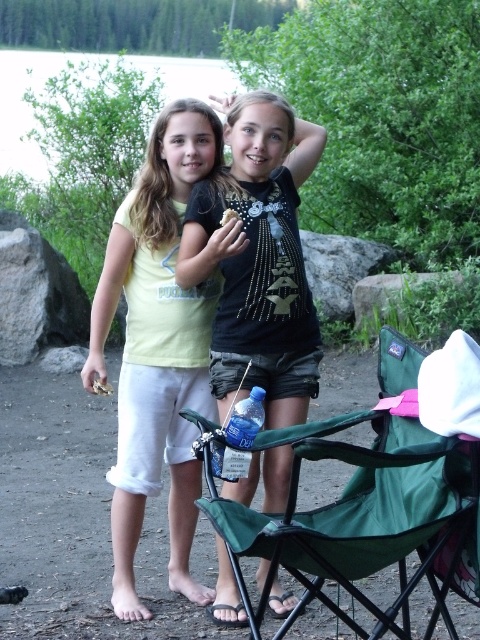
Between green fabric chair at lower center and matte yellow t-shirt at center, which one has less height?

With less height is green fabric chair at lower center.

Is green fabric chair at lower center closer to camera compared to matte yellow t-shirt at center?

Yes, green fabric chair at lower center is in front of matte yellow t-shirt at center.

Where is `green fabric chair at lower center`? The height and width of the screenshot is (640, 480). green fabric chair at lower center is located at coordinates pos(367,506).

Is matte yellow t-shirt at center thinner than black matte shirt at center?

Yes, matte yellow t-shirt at center is thinner than black matte shirt at center.

Is matte yellow t-shirt at center positioned behind black matte shirt at center?

Yes, matte yellow t-shirt at center is behind black matte shirt at center.

Is point (145, 275) positioned after point (284, 500)?

Yes, it is.

Find the location of a particular element. matte yellow t-shirt at center is located at coordinates (156, 348).

Looking at this image, does green fabric chair at lower center appear on the left side of black matte shirt at center?

In fact, green fabric chair at lower center is to the right of black matte shirt at center.

Does green fabric chair at lower center have a smaller size compared to black matte shirt at center?

Incorrect, green fabric chair at lower center is not smaller in size than black matte shirt at center.

In order to click on green fabric chair at lower center in this screenshot , I will do `click(367, 506)`.